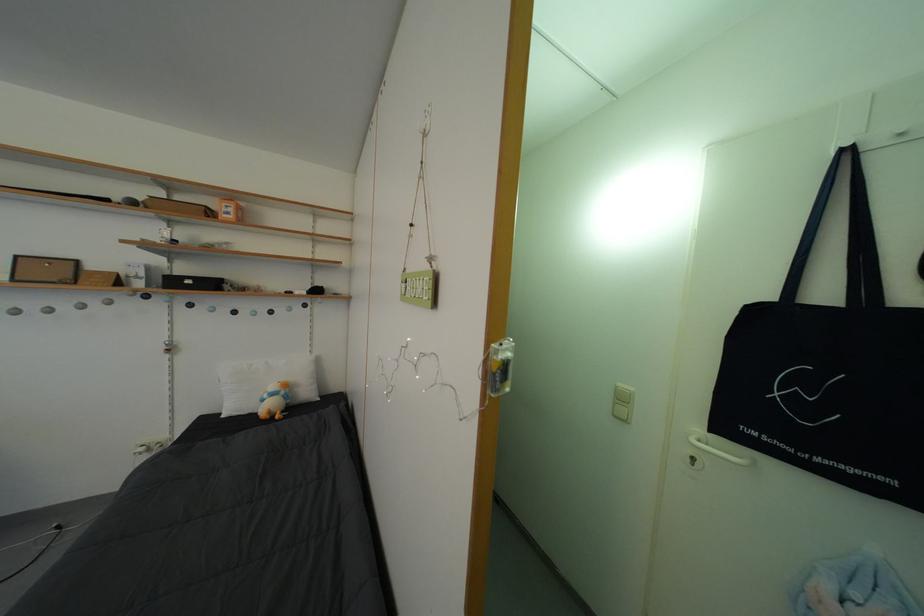
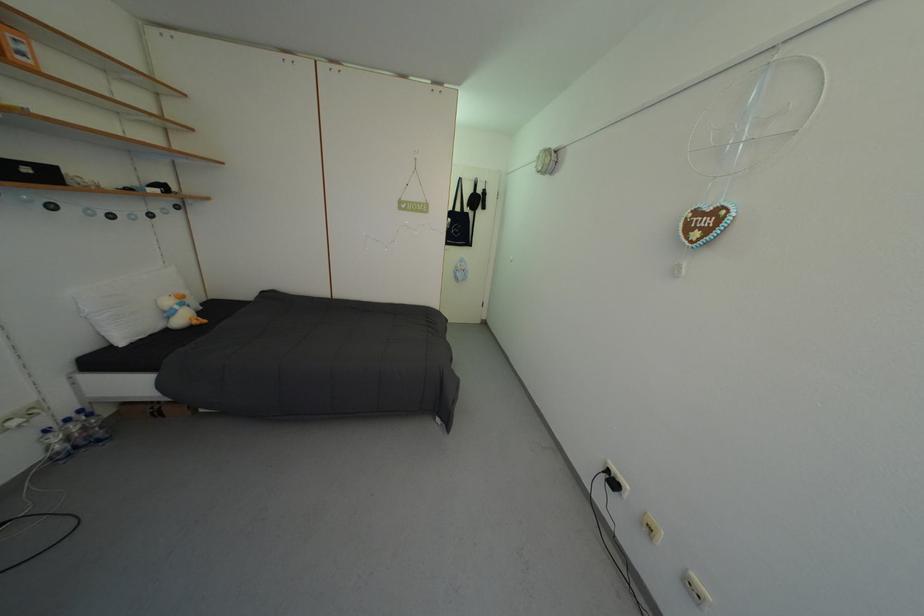
In the second image, find the point that corresponds to pixel 295 392 in the first image.

(190, 302)